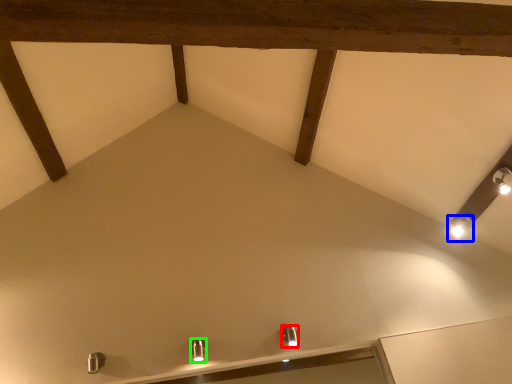
Question: Based on their relative distances, which object is farther from light fixture (highlighted by a red box)? Choose from light fixture (highlighted by a blue box) and light fixture (highlighted by a green box).

Choices:
 (A) light fixture
 (B) light fixture

Answer: (A)